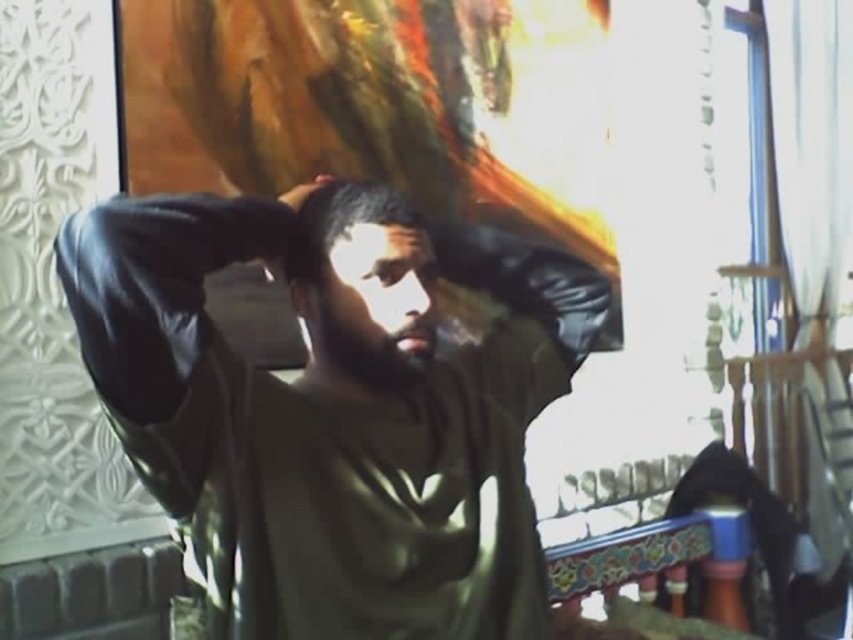
You are a fashion designer observing the scene. You notice the leather jacket at center and the black leather hand at upper center. Which object is positioned higher in the image?

The black leather hand at upper center is positioned higher than the leather jacket at center.

You are a fashion designer observing the image. You need to determine the correct order of the dark green fabric at center and dark matte hair at center from top to bottom. Which one is positioned higher?

The dark matte hair at center is positioned higher than the dark green fabric at center.

You are a tailor measuring two items on a person in the image. The items are the dark green fabric at center and the dark matte hair at center. Which item has a larger surface area?

The dark green fabric at center is larger in size than the dark matte hair at center, so the dark green fabric at center has a larger surface area.